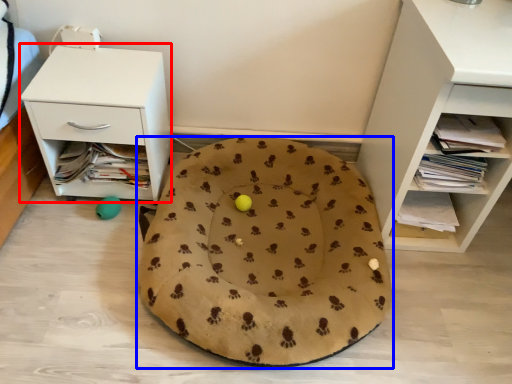
Question: Which of the following is the farthest to the observer, nightstand (highlighted by a red box) or dog bed (highlighted by a blue box)?

Choices:
 (A) nightstand
 (B) dog bed

Answer: (A)